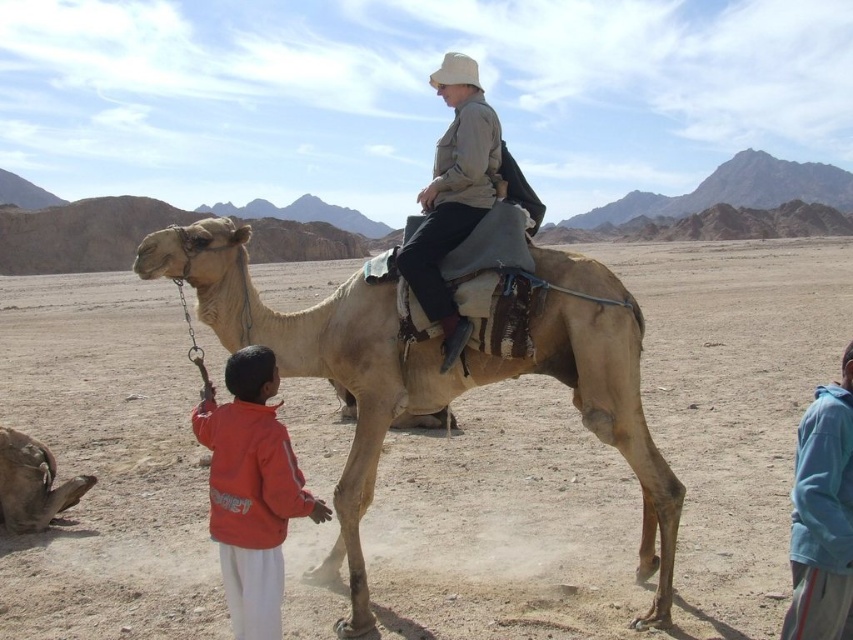
Question: Which point is closer to the camera?

Choices:
 (A) (254, 563)
 (B) (6, 440)
 (C) (366, 461)

Answer: (A)

Question: From the image, what is the correct spatial relationship of beige rough camel at center in relation to light brown leather camel at lower left?

Choices:
 (A) below
 (B) above

Answer: (B)

Question: Which point appears farthest from the camera in this image?

Choices:
 (A) (51, 461)
 (B) (173, 260)
 (C) (257, 579)
 (D) (462, 330)

Answer: (A)

Question: Among these points, which one is nearest to the camera?

Choices:
 (A) (447, 225)
 (B) (252, 634)
 (C) (4, 442)

Answer: (B)

Question: Observing the image, what is the correct spatial positioning of beige rough camel at center in reference to light brown leather camel at lower left?

Choices:
 (A) left
 (B) right

Answer: (B)

Question: Does beige rough camel at center appear on the right side of light brown leather jacket at center?

Choices:
 (A) yes
 (B) no

Answer: (B)